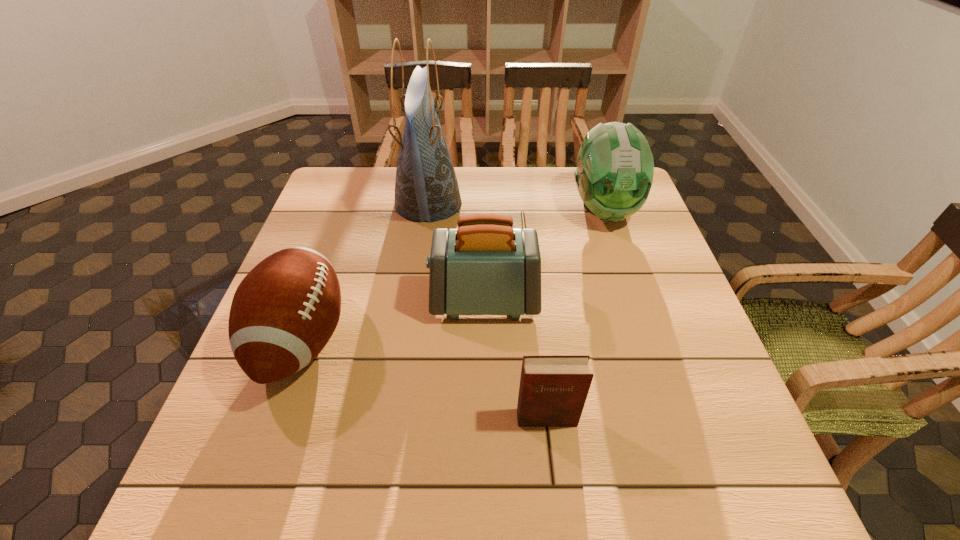
Where is `shopping bag`? This screenshot has height=540, width=960. shopping bag is located at coordinates (x=426, y=188).

At what (x,y) coordinates should I click in order to perform the action: click on football helmet. Please return your answer as a coordinate pair (x, y). Image resolution: width=960 pixels, height=540 pixels. Looking at the image, I should click on (614, 174).

Find the location of a particular element. The image size is (960, 540). toaster is located at coordinates (485, 267).

The height and width of the screenshot is (540, 960). I want to click on football, so click(x=283, y=313).

Locate an element on the screen. Image resolution: width=960 pixels, height=540 pixels. diary is located at coordinates (553, 389).

This screenshot has height=540, width=960. Find the location of `free location located on the front of the shopping bag`. free location located on the front of the shopping bag is located at coordinates (420, 257).

Locate an element on the screen. This screenshot has height=540, width=960. blank area located on the visor of the football helmet is located at coordinates (638, 313).

Find the location of a particular element. vacant space located on the front-facing side of the toaster is located at coordinates (303, 301).

Identify the location of vacant space located on the front-facing side of the toaster. (400, 301).

Find the location of a particular element. The width and height of the screenshot is (960, 540). vacant space located 0.320m on the front-facing side of the toaster is located at coordinates (291, 301).